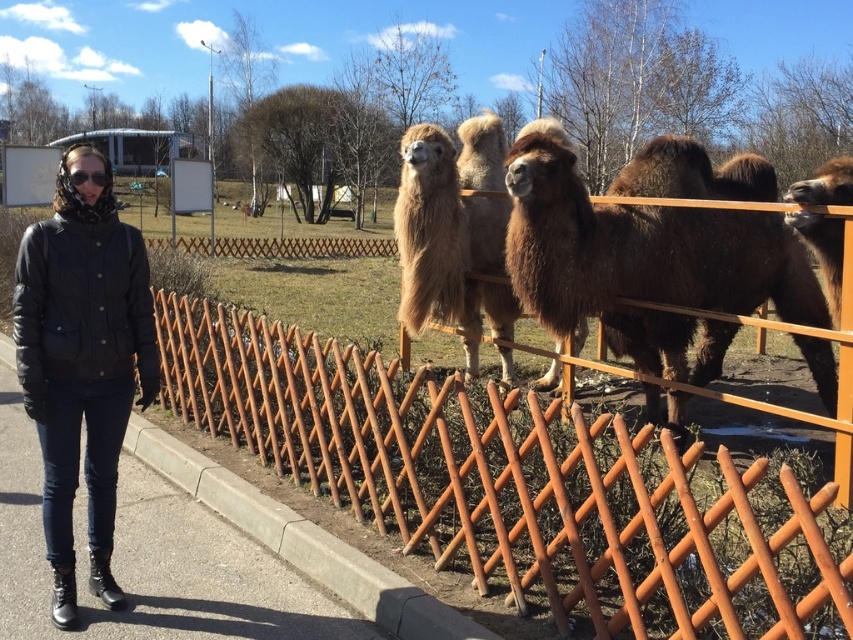
Between point (625, 268) and point (86, 176), which one is positioned behind?

Point (625, 268)

Is brown fuzzy camel at right further to the viewer compared to clear plastic goggles at upper left?

Yes, it is behind clear plastic goggles at upper left.

Does point (682, 272) come behind point (94, 177)?

Yes, point (682, 272) is farther from viewer.

The width and height of the screenshot is (853, 640). Identify the location of brown fuzzy camel at right. [643, 262].

Is black quilted jacket at left above fuzzy brown alpaca at center?

Yes, black quilted jacket at left is above fuzzy brown alpaca at center.

Does black quilted jacket at left have a greater height compared to fuzzy brown alpaca at center?

Yes.

This screenshot has height=640, width=853. I want to click on black quilted jacket at left, so click(82, 364).

Who is positioned more to the left, fuzzy brown alpaca at center or clear plastic goggles at upper left?

From the viewer's perspective, clear plastic goggles at upper left appears more on the left side.

The width and height of the screenshot is (853, 640). Find the location of `fuzzy brown alpaca at center`. fuzzy brown alpaca at center is located at coordinates (453, 228).